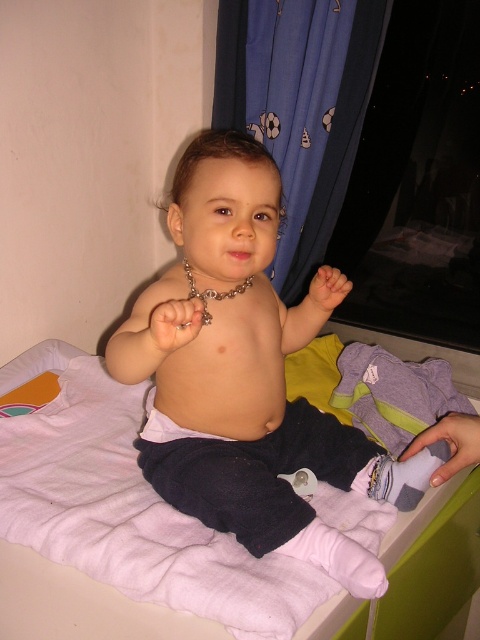
Which is more to the left, nude fabric baby at center or purple soft cloth at center?

nude fabric baby at center is more to the left.

In order to click on nude fabric baby at center in this screenshot , I will do `click(247, 376)`.